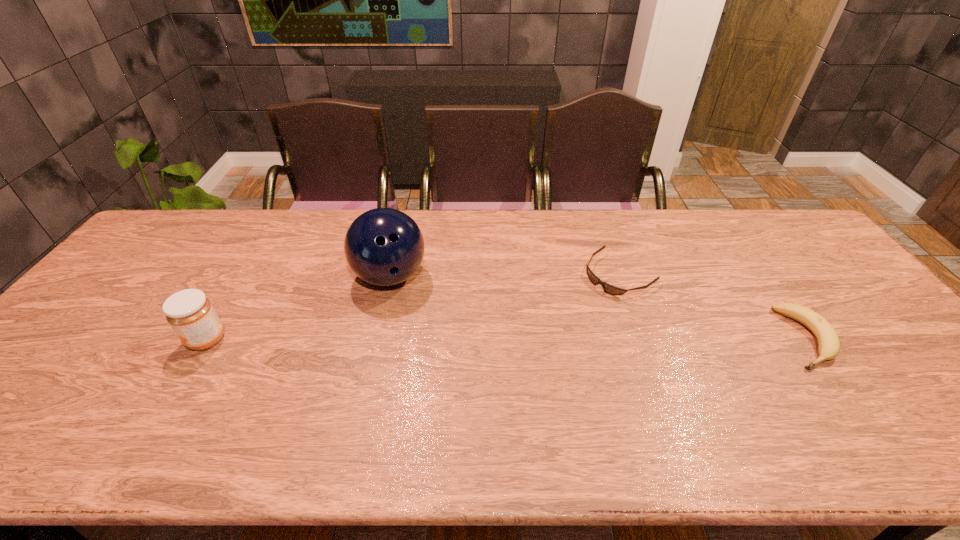
This screenshot has width=960, height=540. What are the coordinates of `vacant space at the left edge of the desktop` in the screenshot? It's located at (82, 370).

Locate an element on the screen. vacant position at the far right corner of the desktop is located at coordinates (763, 240).

In the image, there is a desktop. Identify the location of free space at the near right corner. (918, 403).

The height and width of the screenshot is (540, 960). In order to click on free space between the bowling ball and the third tallest object in this screenshot , I will do `click(598, 307)`.

Identify the location of unoccupied area between the second tallest object and the third object from right to left. Image resolution: width=960 pixels, height=540 pixels. (299, 308).

This screenshot has height=540, width=960. Find the location of `free space between the leftmost object and the third object from right to left`. free space between the leftmost object and the third object from right to left is located at coordinates (299, 308).

Find the location of a particular element. free space between the bowling ball and the sunglasses is located at coordinates (505, 275).

Locate an element on the screen. This screenshot has width=960, height=540. vacant area that lies between the shortest object and the banana is located at coordinates (712, 306).

The width and height of the screenshot is (960, 540). Find the location of `free space between the third object from left to right and the leftmost object`. free space between the third object from left to right and the leftmost object is located at coordinates (413, 307).

This screenshot has width=960, height=540. Find the location of `free area in between the third shortest object and the bowling ball`. free area in between the third shortest object and the bowling ball is located at coordinates (299, 308).